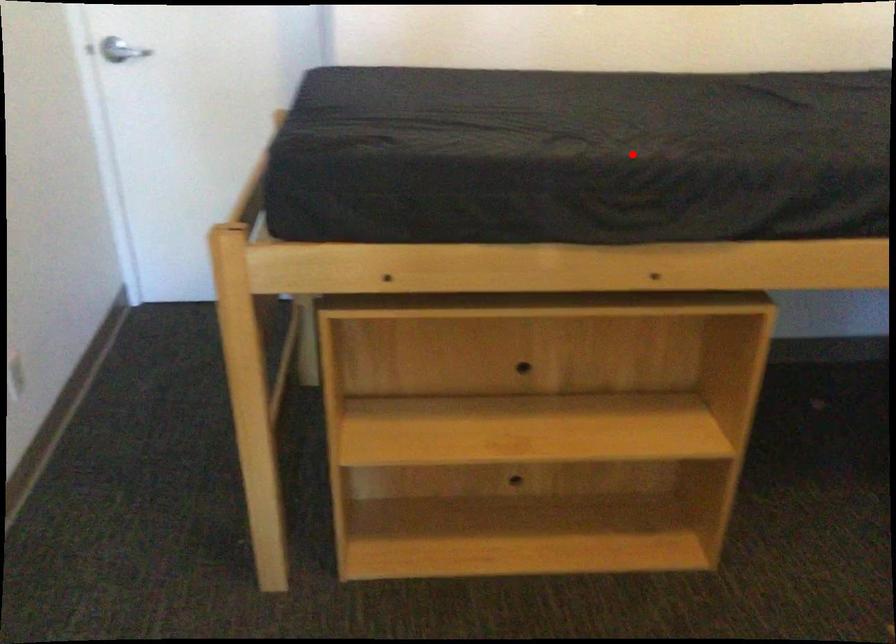
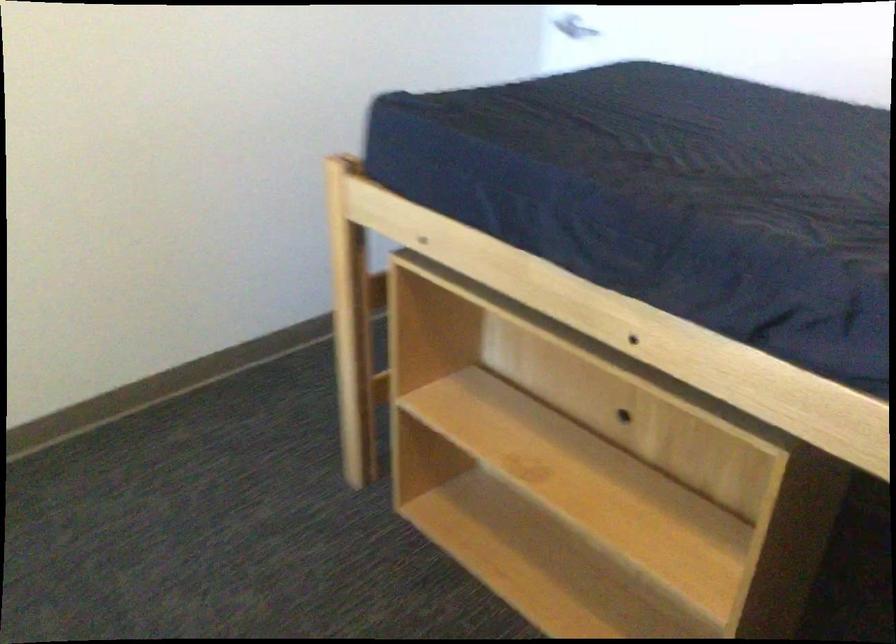
Question: I am providing you with two images of the same scene from different viewpoints. A red point is shown in image1. For the corresponding object point in image2, is it positioned nearer or farther from the camera?

Choices:
 (A) Nearer
 (B) Farther

Answer: (A)